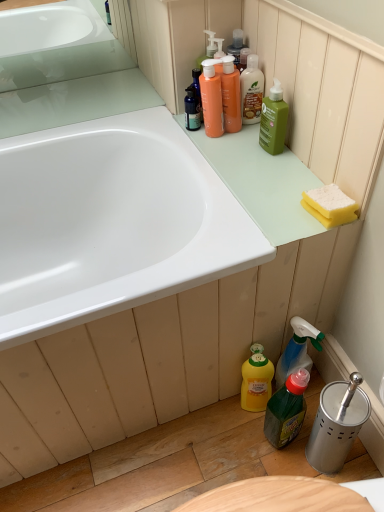
Locate an element on the screen. This screenshot has height=512, width=384. vacant region to the left of translucent plastic mouthwash at upper center is located at coordinates (173, 127).